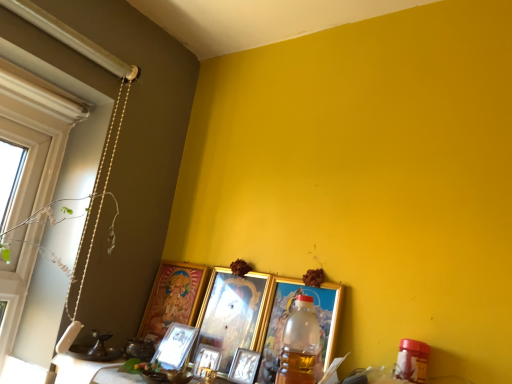
Question: From the image's perspective, is white matte window at left under metallic silver picture frame at center, acting as the 3th picture frame starting from the left?

Choices:
 (A) yes
 (B) no

Answer: (B)

Question: From a real-world perspective, is white matte window at left physically above metallic silver picture frame at center, acting as the 3th picture frame starting from the left?

Choices:
 (A) no
 (B) yes

Answer: (B)

Question: Is white matte window at left taller than metallic silver picture frame at center, acting as the 3th picture frame starting from the left?

Choices:
 (A) no
 (B) yes

Answer: (B)

Question: Can you confirm if white matte window at left is shorter than metallic silver picture frame at center, acting as the 3th picture frame starting from the left?

Choices:
 (A) yes
 (B) no

Answer: (B)

Question: Considering the relative positions of white matte window at left and metallic silver picture frame at center, positioned as the 4th picture frame in right-to-left order, in the image provided, is white matte window at left to the left of metallic silver picture frame at center, positioned as the 4th picture frame in right-to-left order, from the viewer's perspective?

Choices:
 (A) yes
 (B) no

Answer: (A)

Question: Does point (161, 304) appear closer or farther from the camera than point (221, 365)?

Choices:
 (A) closer
 (B) farther

Answer: (B)

Question: From the image's perspective, is gold-framed picture at lower left, the 6th picture frame positioned from the right, located above or below gold metallic picture frame at center, the third picture frame positioned from the right?

Choices:
 (A) above
 (B) below

Answer: (A)

Question: In terms of width, does gold-framed picture at lower left, the first picture frame from the left, look wider or thinner when compared to gold metallic picture frame at center, the third picture frame positioned from the right?

Choices:
 (A) wide
 (B) thin

Answer: (A)

Question: Considering the positions of gold-framed picture at lower left, the 6th picture frame positioned from the right, and gold metallic picture frame at center, which is counted as the 4th picture frame, starting from the left, in the image, is gold-framed picture at lower left, the 6th picture frame positioned from the right, bigger or smaller than gold metallic picture frame at center, which is counted as the 4th picture frame, starting from the left,?

Choices:
 (A) small
 (B) big

Answer: (B)

Question: Is translucent plastic bottle at center to the left or to the right of metallic silver picture frame at lower center, the 2th picture frame from the left, in the image?

Choices:
 (A) right
 (B) left

Answer: (A)

Question: Is translucent plastic bottle at center in front of or behind metallic silver picture frame at lower center, which appears as the 5th picture frame when viewed from the right, in the image?

Choices:
 (A) front
 (B) behind

Answer: (A)

Question: Is translucent plastic bottle at center inside the boundaries of metallic silver picture frame at lower center, the 2th picture frame from the left, or outside?

Choices:
 (A) outside
 (B) inside

Answer: (A)

Question: From the image's perspective, relative to metallic silver picture frame at lower center, the 2th picture frame from the left, is translucent plastic bottle at center above or below?

Choices:
 (A) below
 (B) above

Answer: (B)

Question: Is gold-framed picture at lower left, the 6th picture frame positioned from the right, bigger or smaller than metallic silver picture frame at lower center, which appears as the 5th picture frame when viewed from the right?

Choices:
 (A) big
 (B) small

Answer: (A)

Question: Is gold-framed picture at lower left, the first picture frame from the left, inside or outside of metallic silver picture frame at lower center, the 2th picture frame from the left?

Choices:
 (A) outside
 (B) inside

Answer: (A)